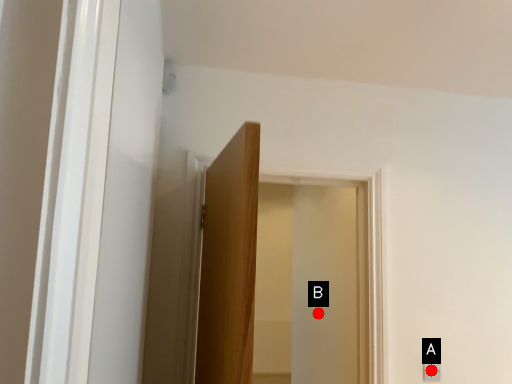
Question: Two points are circled on the image, labeled by A and B beside each circle. Which point is closer to the camera?

Choices:
 (A) A is closer
 (B) B is closer

Answer: (A)